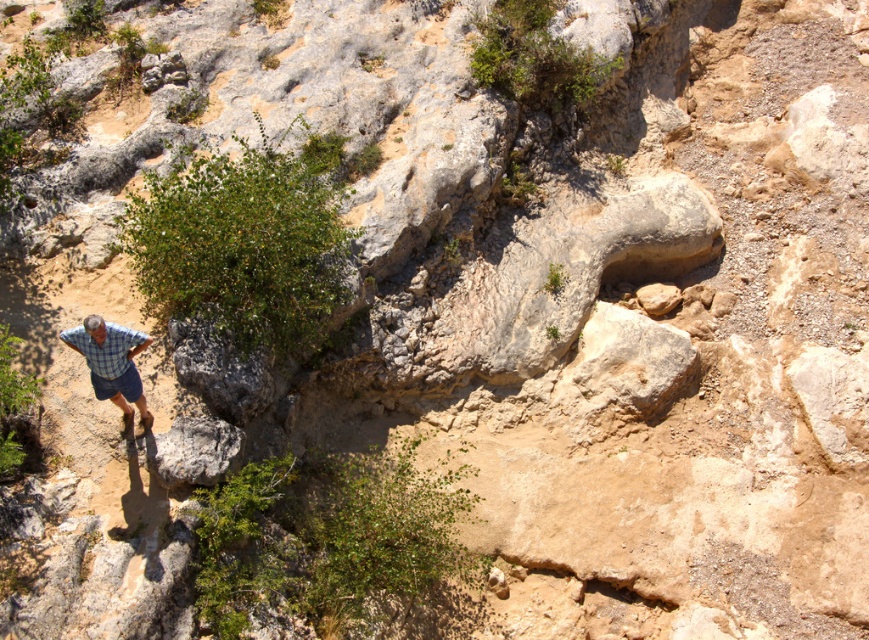
Question: Can you confirm if gray rough rock at lower left is thinner than blue plaid shorts at lower left?

Choices:
 (A) no
 (B) yes

Answer: (A)

Question: Which point is farther from the camera taking this photo?

Choices:
 (A) (239, 442)
 (B) (110, 388)

Answer: (A)

Question: From the image, what is the correct spatial relationship of gray rough rock at lower left in relation to checkered fabric hiker at lower left?

Choices:
 (A) right
 (B) left

Answer: (A)

Question: Which of the following is the farthest from the observer?

Choices:
 (A) checkered fabric hiker at lower left
 (B) blue plaid shorts at lower left
 (C) gray rough rock at lower left

Answer: (C)

Question: Does gray rough rock at lower left have a smaller size compared to checkered fabric hiker at lower left?

Choices:
 (A) yes
 (B) no

Answer: (A)

Question: Among these objects, which one is nearest to the camera?

Choices:
 (A) checkered fabric hiker at lower left
 (B) gray rough rock at lower left

Answer: (A)